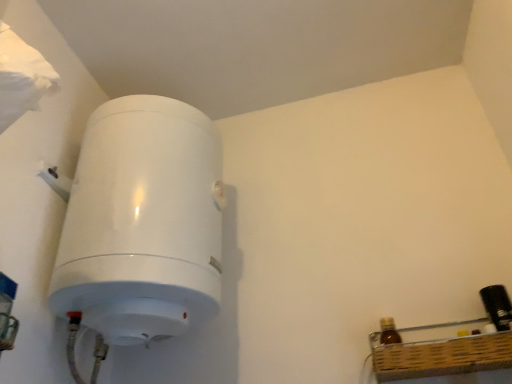
Question: From a real-world perspective, relative to black plastic bottle at right, the second bottle in the left-to-right sequence, is white glossy water heater at left vertically above or below?

Choices:
 (A) below
 (B) above

Answer: (B)

Question: From their relative heights in the image, would you say white glossy water heater at left is taller or shorter than black plastic bottle at right, marked as the first bottle in a right-to-left arrangement?

Choices:
 (A) short
 (B) tall

Answer: (B)

Question: Estimate the real-world distances between objects in this image. Which object is closer to the brown glass bottle at lower right, which appears as the 2th bottle when viewed from the right?

Choices:
 (A) black plastic bottle at right, marked as the first bottle in a right-to-left arrangement
 (B) white glossy water heater at left

Answer: (A)

Question: Which object is the closest to the white glossy water heater at left?

Choices:
 (A) brown glass bottle at lower right, which appears as the 2th bottle when viewed from the right
 (B) black plastic bottle at right, marked as the first bottle in a right-to-left arrangement

Answer: (A)